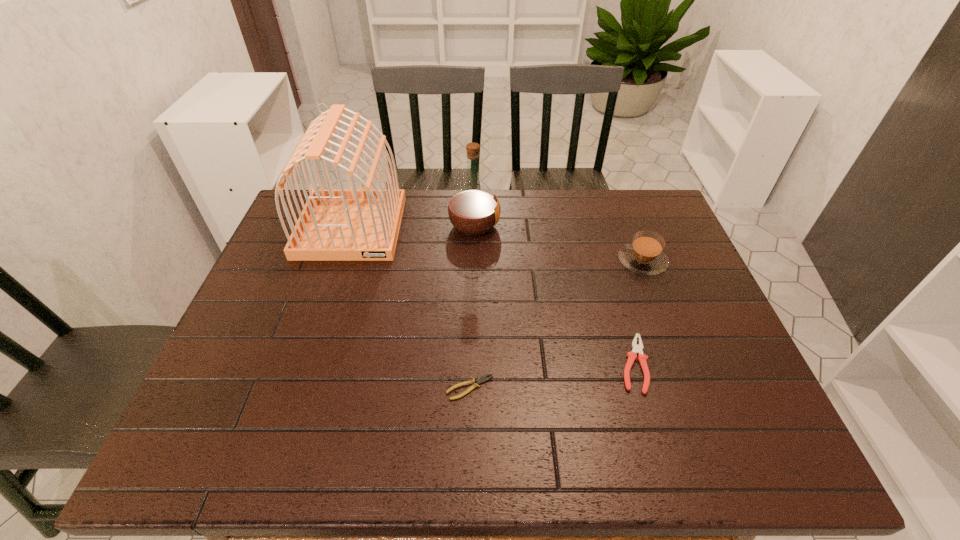
You are a GUI agent. You are given a task and a screenshot of the screen. Output one action in this format:
    pyautogui.click(x=<x>, y=<y>)
    Task: Click on the vacant region at the near edge of the desktop
    The image size is (960, 540).
    Given the screenshot: What is the action you would take?
    (401, 458)

What are the coordinates of `vacant space at the left edge` in the screenshot? It's located at (306, 309).

Where is `free spot at the right edge of the desktop`? The height and width of the screenshot is (540, 960). free spot at the right edge of the desktop is located at coordinates (670, 248).

You are a GUI agent. You are given a task and a screenshot of the screen. Output one action in this format:
    pyautogui.click(x=<x>, y=<y>)
    Task: Click on the vacant space at the far right corner of the desktop
    
    Given the screenshot: What is the action you would take?
    pyautogui.click(x=627, y=227)

What are the coordinates of `free point between the shorter pliers and the liquor` in the screenshot? It's located at (472, 307).

Identify the location of vacant area that lies between the rightmost object and the birdcage. (496, 244).

Find the location of `free space that is in between the liquor and the left pliers`. free space that is in between the liquor and the left pliers is located at coordinates (472, 307).

Where is `free space between the second tallest object and the fourth object from left to right`? This screenshot has height=540, width=960. free space between the second tallest object and the fourth object from left to right is located at coordinates (554, 295).

The image size is (960, 540). Identify the location of empty space that is in between the cappuccino and the fourth object from left to right. (637, 313).

Where is `vacant point located between the right pliers and the cappuccino`? Image resolution: width=960 pixels, height=540 pixels. vacant point located between the right pliers and the cappuccino is located at coordinates (637, 313).